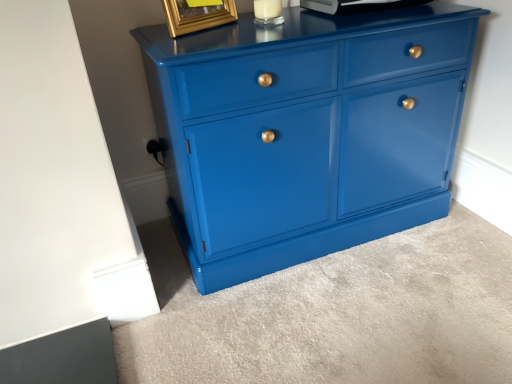
What is the approximate height of metallic silver appliance at upper center?

metallic silver appliance at upper center is 5.02 centimeters in height.

The height and width of the screenshot is (384, 512). Find the location of `metallic silver appliance at upper center`. metallic silver appliance at upper center is located at coordinates (355, 5).

Which of these two, metallic silver appliance at upper center or gold metallic picture frame at upper center, stands taller?

With more height is gold metallic picture frame at upper center.

From a real-world perspective, which is physically above, metallic silver appliance at upper center or gold metallic picture frame at upper center?

From a 3D spatial view, gold metallic picture frame at upper center is above.

How much distance is there between metallic silver appliance at upper center and gold metallic picture frame at upper center?

11.75 inches.

Between metallic silver appliance at upper center and gold metallic picture frame at upper center, which one has smaller size?

gold metallic picture frame at upper center is smaller.

Based on the photo, from the image's perspective, who appears lower, metallic silver appliance at upper center or glossy blue cabinet at center?

glossy blue cabinet at center appears lower in the image.

Is metallic silver appliance at upper center oriented away from glossy blue cabinet at center?

metallic silver appliance at upper center is not turned away from glossy blue cabinet at center.

Is glossy blue cabinet at center completely or partially inside metallic silver appliance at upper center?

No, glossy blue cabinet at center is not a part of metallic silver appliance at upper center.

Which of these two, metallic silver appliance at upper center or glossy blue cabinet at center, is wider?

Wider between the two is glossy blue cabinet at center.

From the picture: Does gold metallic picture frame at upper center come in front of metallic silver appliance at upper center?

That is True.

Which of these two, gold metallic picture frame at upper center or metallic silver appliance at upper center, stands taller?

gold metallic picture frame at upper center.

Considering the sizes of objects gold metallic picture frame at upper center and metallic silver appliance at upper center in the image provided, who is thinner, gold metallic picture frame at upper center or metallic silver appliance at upper center?

gold metallic picture frame at upper center is thinner.

Can you confirm if gold metallic picture frame at upper center is positioned to the left of metallic silver appliance at upper center?

→ Correct, you'll find gold metallic picture frame at upper center to the left of metallic silver appliance at upper center.

From the image's perspective, which is above, gold metallic picture frame at upper center or glossy blue cabinet at center?

gold metallic picture frame at upper center appears higher in the image.

From a real-world perspective, who is located higher, gold metallic picture frame at upper center or glossy blue cabinet at center?

From a 3D spatial view, gold metallic picture frame at upper center is above.

Is point (186, 22) closer or farther from the camera than point (223, 269)?

Point (186, 22) is positioned closer to the camera compared to point (223, 269).

This screenshot has height=384, width=512. I want to click on picture frame above the glossy blue cabinet at center (from a real-world perspective), so [197, 15].

Can you see glossy blue cabinet at center touching gold metallic picture frame at upper center?

No, glossy blue cabinet at center is not beside gold metallic picture frame at upper center.

From the image's perspective, is glossy blue cabinet at center under gold metallic picture frame at upper center?

Yes.

Is glossy blue cabinet at center shorter than metallic silver appliance at upper center?

In fact, glossy blue cabinet at center may be taller than metallic silver appliance at upper center.

Which object is closer to the camera taking this photo, glossy blue cabinet at center or metallic silver appliance at upper center?

glossy blue cabinet at center is in front.

Is glossy blue cabinet at center oriented towards metallic silver appliance at upper center?

No, glossy blue cabinet at center does not turn towards metallic silver appliance at upper center.

How different are the orientations of glossy blue cabinet at center and metallic silver appliance at upper center in degrees?

The angular difference between glossy blue cabinet at center and metallic silver appliance at upper center is 0.99 degrees.

Image resolution: width=512 pixels, height=384 pixels. Identify the location of appliance located on the right of gold metallic picture frame at upper center. (355, 5).

Where is `the chest of drawers located underneath the metallic silver appliance at upper center (from a real-world perspective)`? The image size is (512, 384). the chest of drawers located underneath the metallic silver appliance at upper center (from a real-world perspective) is located at coordinates (306, 132).

Considering their positions, is metallic silver appliance at upper center positioned closer to glossy blue cabinet at center than gold metallic picture frame at upper center?

metallic silver appliance at upper center is closer to glossy blue cabinet at center.

When comparing their distances from metallic silver appliance at upper center, does glossy blue cabinet at center or gold metallic picture frame at upper center seem further?

Based on the image, glossy blue cabinet at center appears to be further to metallic silver appliance at upper center.

Looking at the image, which one is located closer to metallic silver appliance at upper center, gold metallic picture frame at upper center or glossy blue cabinet at center?

gold metallic picture frame at upper center.

Looking at the image, which one is located further to glossy blue cabinet at center, gold metallic picture frame at upper center or metallic silver appliance at upper center?

gold metallic picture frame at upper center lies further to glossy blue cabinet at center than the other object.

Based on their spatial positions, is metallic silver appliance at upper center or glossy blue cabinet at center further from gold metallic picture frame at upper center?

glossy blue cabinet at center lies further to gold metallic picture frame at upper center than the other object.

Which object lies further to the anchor point gold metallic picture frame at upper center, glossy blue cabinet at center or metallic silver appliance at upper center?

glossy blue cabinet at center is positioned further to the anchor gold metallic picture frame at upper center.

I want to click on chest of drawers between gold metallic picture frame at upper center and metallic silver appliance at upper center, so click(x=306, y=132).